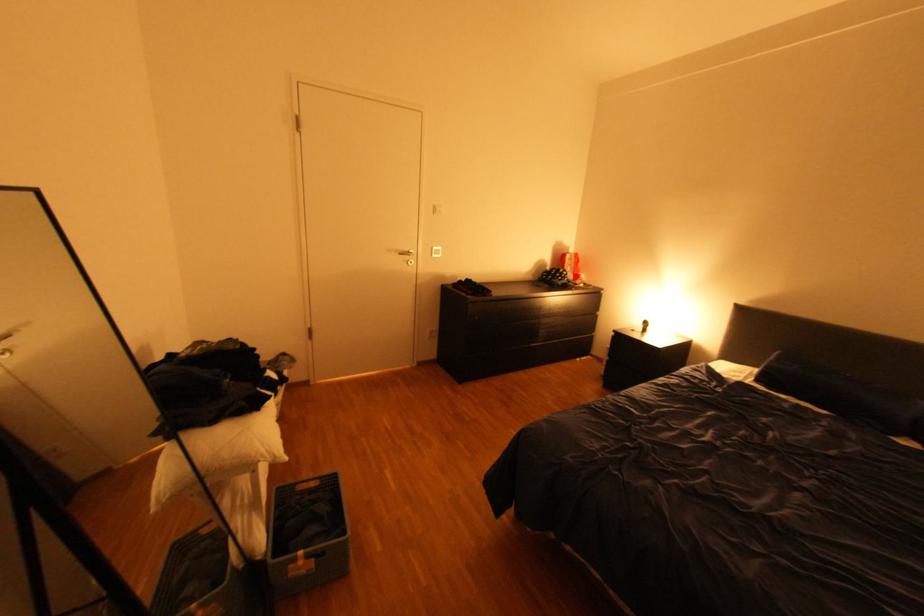
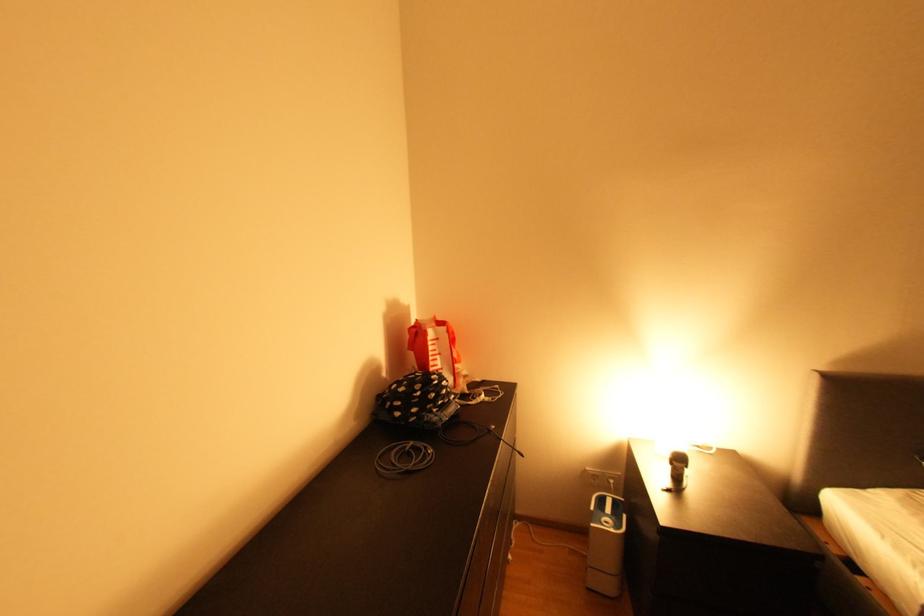
In the second image, find the point that corresponds to the highlighted location in the first image.

(457, 389)